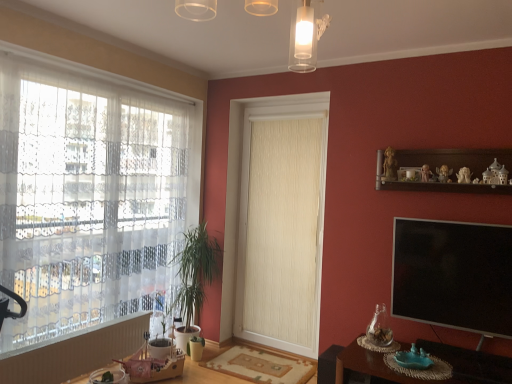
Question: Looking at the image, does brown wooden table at lower right seem bigger or smaller compared to beige textured curtain at center?

Choices:
 (A) big
 (B) small

Answer: (A)

Question: From their relative heights in the image, would you say brown wooden table at lower right is taller or shorter than beige textured curtain at center?

Choices:
 (A) tall
 (B) short

Answer: (B)

Question: Which of these objects is positioned closest to the translucent glass light fixture at upper center?

Choices:
 (A) white lace curtain at left
 (B) wooden round table at lower left
 (C) wooden shelf at upper right
 (D) white textured radiator at lower left
 (E) green leafy plant at left

Answer: (C)

Question: Based on their relative distances, which object is nearer to the white lace curtain at left?

Choices:
 (A) wooden round table at lower left
 (B) translucent glass light fixture at upper center
 (C) beige textured curtain at center
 (D) wooden shelf at upper right
 (E) white textured radiator at lower left

Answer: (E)